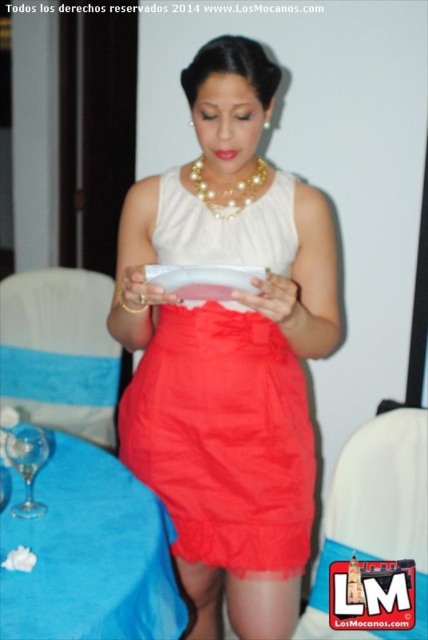
You are a photographer at a formal event. You need to position yourself so that the white satin dress at center and the blue fabric table at lower left are both in your frame. Based on their positions, which object should be placed on your left side when framing the shot?

The blue fabric table at lower left should be placed on your left side because the white satin dress at center is positioned to the right of the blue fabric table at lower left.

You are at a formal event and need to place a small decoration between the two points labeled point (122,220) and point (241,195). Which point is closer to you so you can start placing the decoration from there?

Point (122,220) is closer to you than point (241,195), so you should start placing the decoration from there.

You are at a formal event and need to place a small gift on the table. The gift must be placed between the two points labeled point (133, 557) and point (205, 204). Based on their positions, where should you place the gift relative to these points?

The gift should be placed between point (133, 557) and point (205, 204) such that it is closer to point (133, 557) since it is in front of point (205, 204).